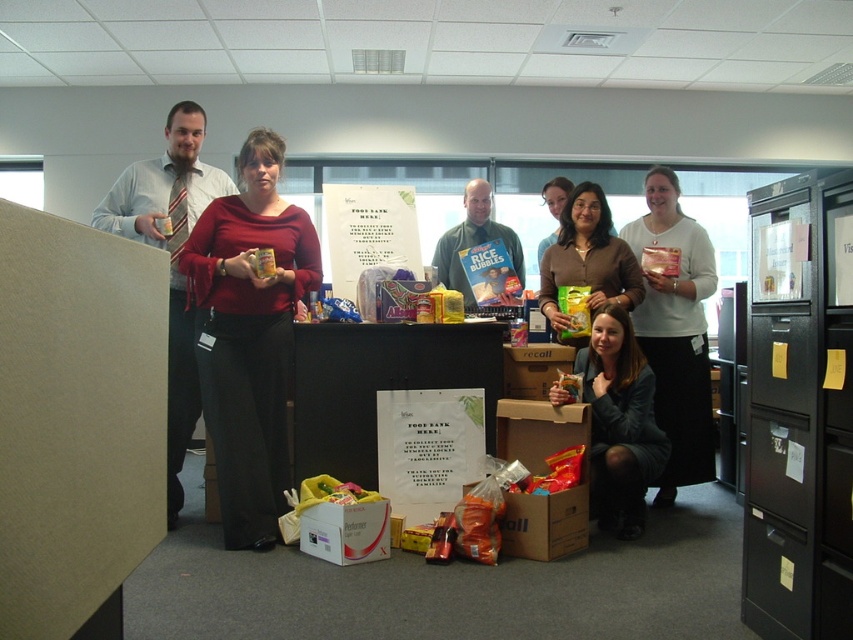
Question: Which of the following is the farthest from the observer?

Choices:
 (A) matte tie at left
 (B) cardboard sign at center
 (C) matte red sweater at center

Answer: (B)

Question: Can you confirm if cardboard sign at center is positioned to the right of matte brown hair at center?

Choices:
 (A) yes
 (B) no

Answer: (B)

Question: Does cardboard box at lower center have a greater width compared to matte brown hair at center?

Choices:
 (A) no
 (B) yes

Answer: (B)

Question: Is matte white shirt at center thinner than brown matte snack packet at center?

Choices:
 (A) no
 (B) yes

Answer: (B)

Question: Which of the following is the closest to the observer?

Choices:
 (A) recall cardboard box at center
 (B) matte black jacket at lower center

Answer: (B)

Question: Based on their relative distances, which object is farther from the white cardboard box at center?

Choices:
 (A) matte green shirt at center
 (B) matte black jacket at lower center
 (C) matte white shirt at center

Answer: (A)